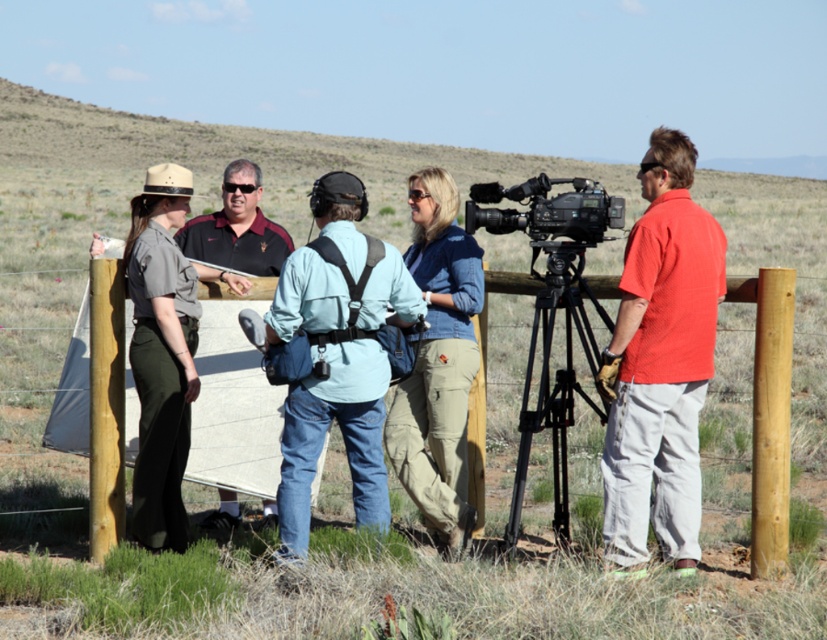
Is red cotton shirt at right wider than wooden fence at center?

Indeed, red cotton shirt at right has a greater width compared to wooden fence at center.

Does red cotton shirt at right lie behind wooden fence at center?

No.

Which is behind, point (625, 513) or point (778, 369)?

The point (778, 369) is more distant.

In order to click on red cotton shirt at right in this screenshot , I will do `click(660, 364)`.

Is wooden fence at center closer to the viewer compared to gray uniform at center?

That is True.

Can you confirm if wooden fence at center is thinner than gray uniform at center?

No.

The height and width of the screenshot is (640, 827). Identify the location of wooden fence at center. (768, 410).

Find the location of `wooden fence at center`. wooden fence at center is located at coordinates (768, 410).

Is red cotton shirt at right to the right of black plastic camera at right from the viewer's perspective?

Correct, you'll find red cotton shirt at right to the right of black plastic camera at right.

Is red cotton shirt at right behind black plastic camera at right?

No, red cotton shirt at right is closer to the viewer.

This screenshot has width=827, height=640. Describe the element at coordinates (660, 364) in the screenshot. I see `red cotton shirt at right` at that location.

Find the location of a particular element. This screenshot has height=640, width=827. red cotton shirt at right is located at coordinates pyautogui.click(x=660, y=364).